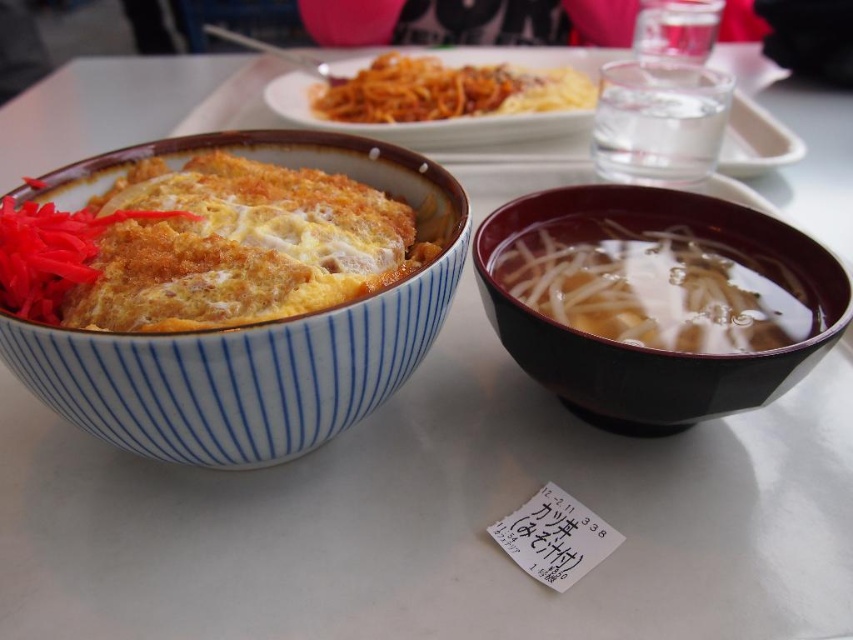
You are a food delivery person who needs to place the black glossy bowl at right and the smooth tomato sauce pasta at upper center into a rectangular box. The box can only fit items that are narrower than 20 cm. Based on the scene, can both items fit into the box?

The black glossy bowl at right is narrower than the smooth tomato sauce pasta at upper center. Since the box can only fit items narrower than 20 cm, we need to know the exact width of the wider item. However, since the tomato pasta is wider than the bowl, if the pasta is under 20 cm, both would fit. But without the exact measurement, we can only confirm the bowl is narrower than the pasta.

You are a food delivery person who needs to place the blue striped bowl at left and the translucent broth at right into a rectangular box. The box can only accommodate items if their widths are equal. Can you fit both items into the box?

The blue striped bowl at left might be wider than translucent broth at right, so it is uncertain if both can fit into the box since their widths may not be equal.